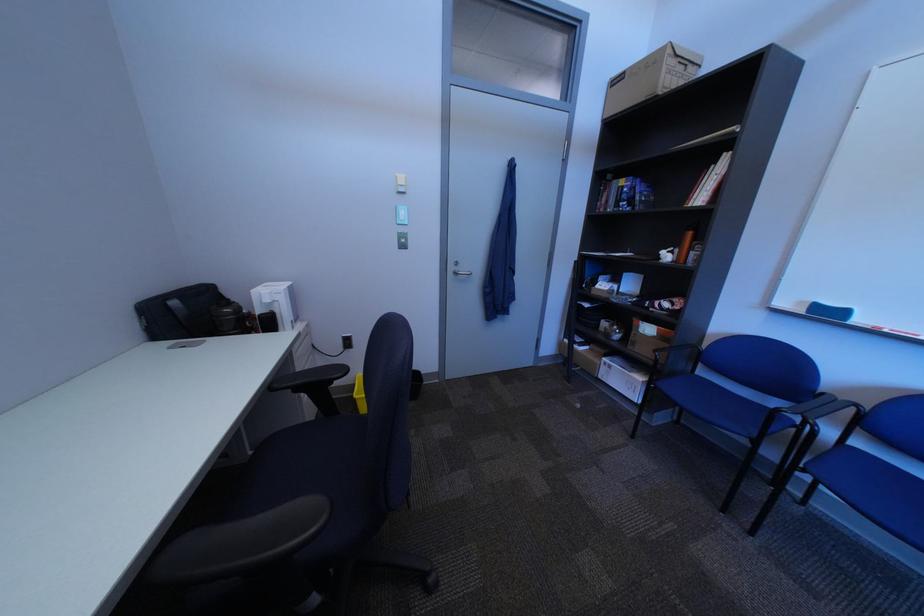
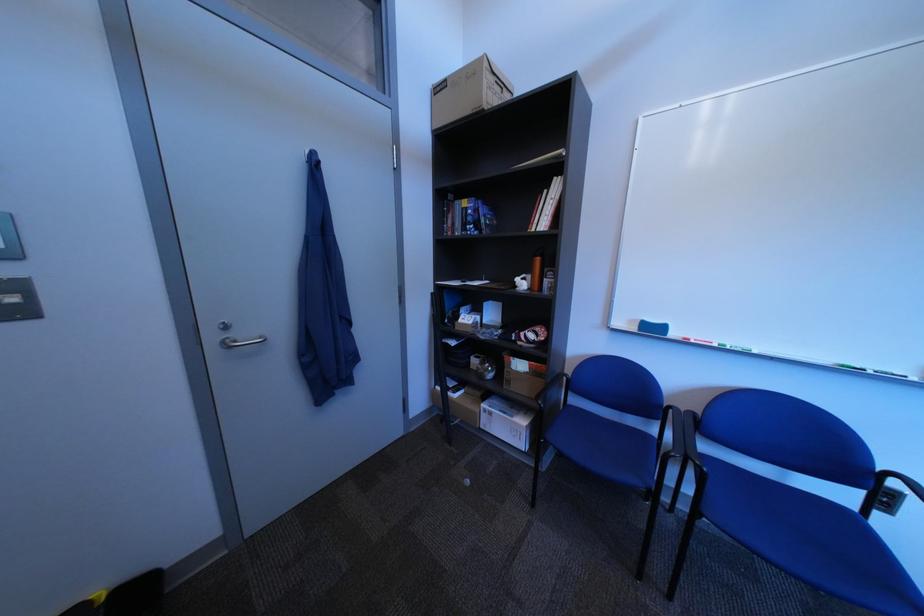
Question: I am providing you with two images of the same scene from different viewpoints. Which of the following objects are not visible in image2?

Choices:
 (A) door hook
 (B) whiteboard marker
 (C) silver door handle
 (D) none of these

Answer: (D)